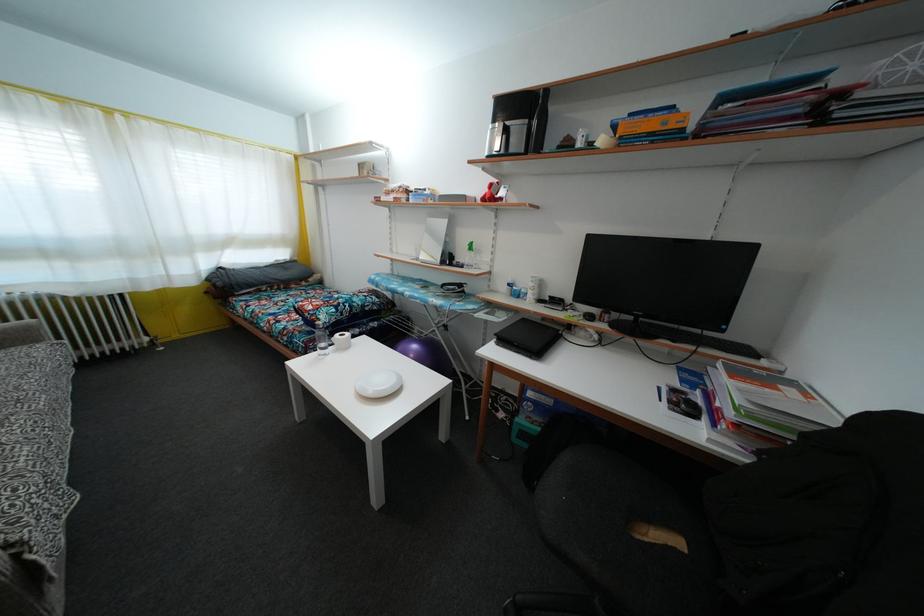
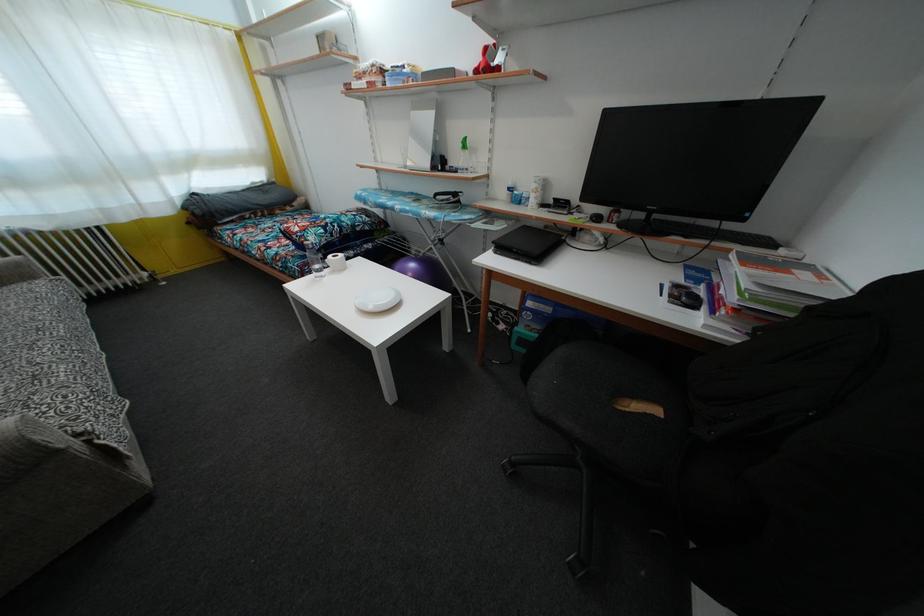
Where in the second image is the point corresponding to the point at 700,338 from the first image?

(719, 230)